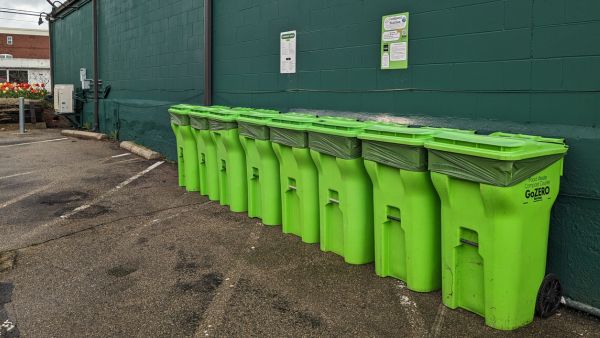
You are a GUI agent. You are given a task and a screenshot of the screen. Output one action in this format:
    pyautogui.click(x=<x>, y=<y>)
    Task: Click on the plastic trash can liners
    
    Given the screenshot: What is the action you would take?
    pyautogui.click(x=184, y=117), pyautogui.click(x=201, y=119), pyautogui.click(x=216, y=123), pyautogui.click(x=248, y=126), pyautogui.click(x=283, y=134), pyautogui.click(x=327, y=141), pyautogui.click(x=381, y=149), pyautogui.click(x=451, y=160)